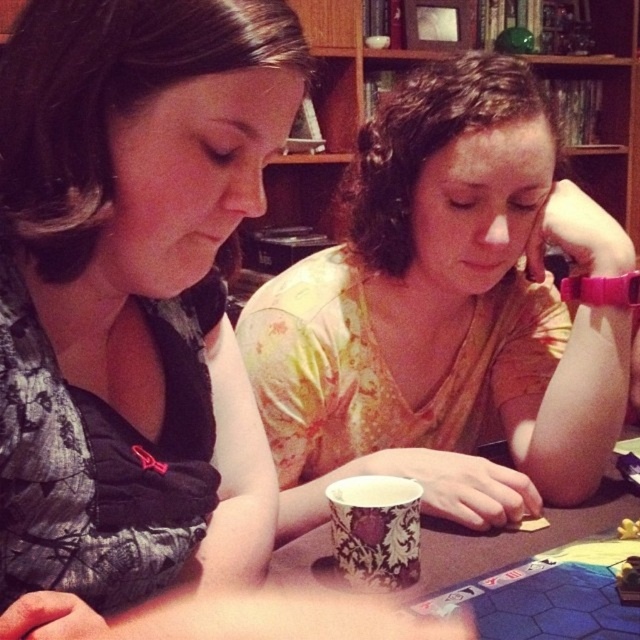
Question: Which of the following is the closest to the observer?

Choices:
 (A) (432, 115)
 (B) (172, 454)
 (C) (545, 513)

Answer: (B)

Question: Which point appears farthest from the camera in this image?

Choices:
 (A) (172, 13)
 (B) (472, 573)
 (C) (392, 324)

Answer: (C)

Question: Can you confirm if matte yellow shirt at center is bigger than white paper cup at center?

Choices:
 (A) yes
 (B) no

Answer: (A)

Question: Which of the following is the closest to the observer?

Choices:
 (A) (42, 316)
 (B) (500, 531)

Answer: (A)

Question: Can you confirm if matte yellow shirt at center is positioned above white paper cup at center?

Choices:
 (A) yes
 (B) no

Answer: (A)

Question: Can you confirm if matte yellow shirt at center is wider than white paper cup at center?

Choices:
 (A) no
 (B) yes

Answer: (A)